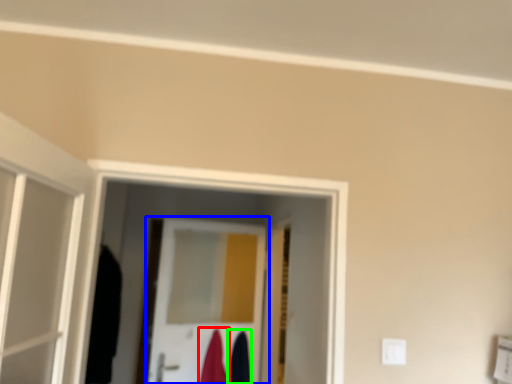
Question: Which object is the farthest from robe (highlighted by a red box)? Choose among these: door (highlighted by a blue box) or robe (highlighted by a green box).

Choices:
 (A) door
 (B) robe

Answer: (A)